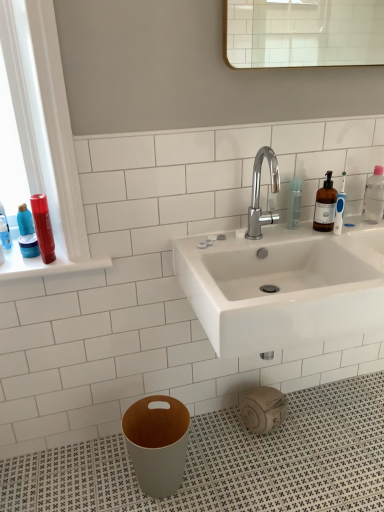
Locate an element on the screen. The height and width of the screenshot is (512, 384). free space to the left of clear plastic bottle at upper right is located at coordinates (272, 234).